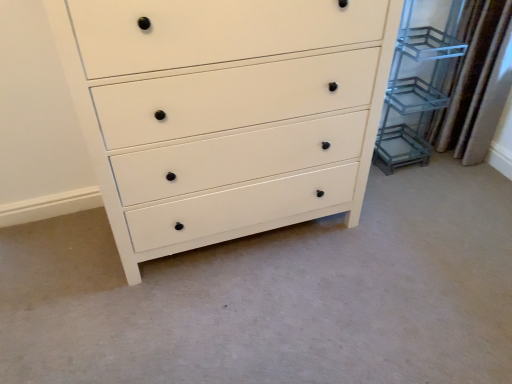
The width and height of the screenshot is (512, 384). I want to click on free location in front of white matte chest of drawers at center, so (x=233, y=317).